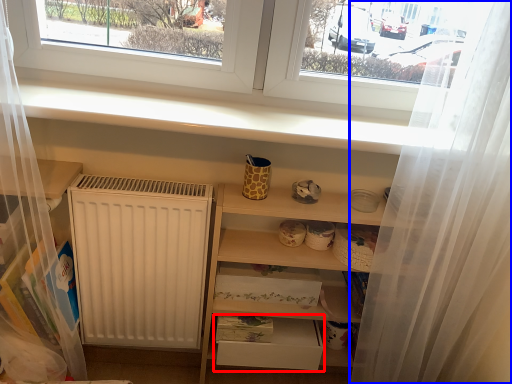
Question: Which of the following is the closest to the observer, drawer (highlighted by a red box) or shower curtain (highlighted by a blue box)?

Choices:
 (A) drawer
 (B) shower curtain

Answer: (B)